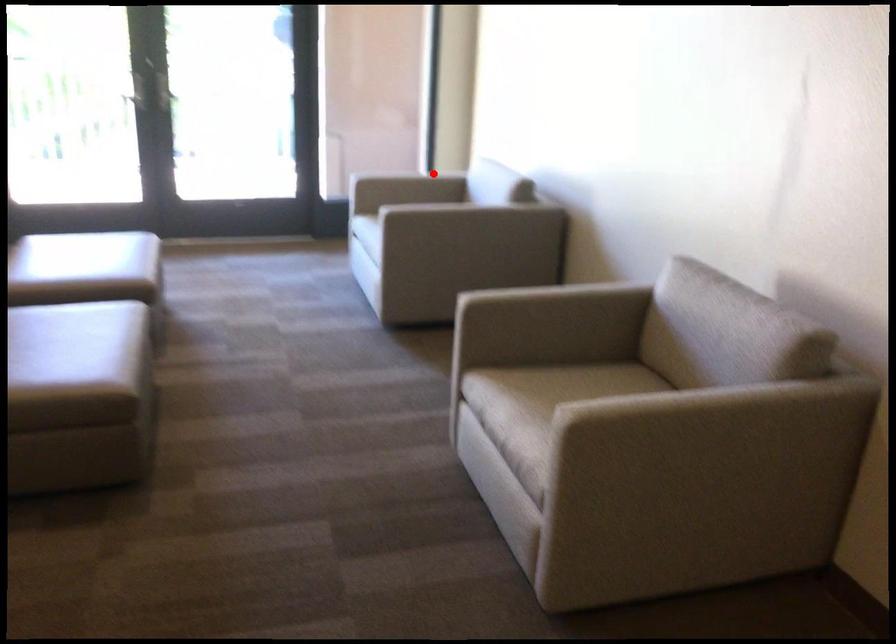
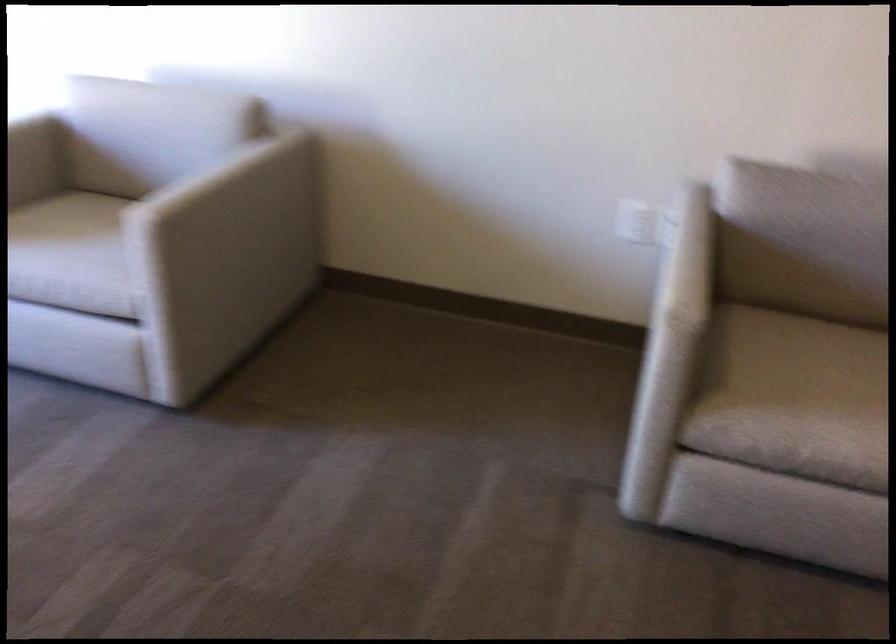
Question: I am providing you with two images of the same scene from different viewpoints. Image1 has a red point marked. In image2, the corresponding 3D location appears at what relative position? Reply with the corresponding letter.

Choices:
 (A) Closer
 (B) Farther

Answer: (A)